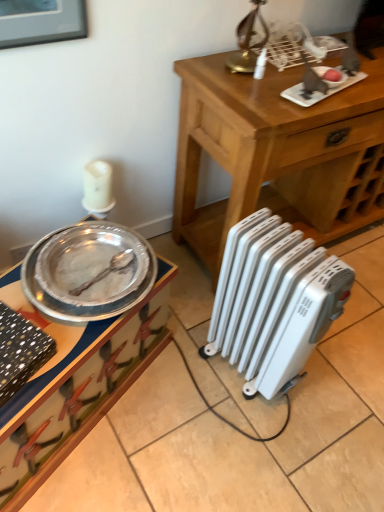
This screenshot has height=512, width=384. Describe the element at coordinates (41, 21) in the screenshot. I see `brushed metal picture frame at upper left` at that location.

Measure the distance between point (225, 353) and camera.

The depth of point (225, 353) is 5.12 feet.

What is the approximate width of wooden table at center?

19.20 inches.

Identify the location of brushed metal picture frame at upper left. This screenshot has height=512, width=384. (41, 21).

I want to click on table on the right of white plastic radiator at lower right, so click(x=277, y=153).

Between white plastic radiator at lower right and wooden table at center, which one has larger width?

wooden table at center.

Is white plastic radiator at lower right shorter than wooden table at center?

Yes, white plastic radiator at lower right is shorter than wooden table at center.

Which point is more distant from viewer, (287, 373) or (327, 136)?

The point (327, 136) is more distant.

How much distance is there between brushed metal picture frame at upper left and metallic silver tray at left?

34.94 inches.

Is brushed metal picture frame at upper left positioned with its back to metallic silver tray at left?

No, brushed metal picture frame at upper left's orientation is not away from metallic silver tray at left.

Is brushed metal picture frame at upper left wider or thinner than metallic silver tray at left?

Considering their sizes, brushed metal picture frame at upper left looks slimmer than metallic silver tray at left.

Is brushed metal picture frame at upper left to the left or to the right of metallic silver tray at left in the image?

In the image, brushed metal picture frame at upper left appears on the left side of metallic silver tray at left.

Is white plastic radiator at lower right wider or thinner than metallic silver tray at left?

Considering their sizes, white plastic radiator at lower right looks slimmer than metallic silver tray at left.

Relative to metallic silver tray at left, is white plastic radiator at lower right in front or behind?

Clearly, white plastic radiator at lower right is behind metallic silver tray at left.

Which is more to the left, white plastic radiator at lower right or metallic silver tray at left?

Positioned to the left is metallic silver tray at left.

From the image's perspective, does white plastic radiator at lower right appear lower than metallic silver tray at left?

No, from the image's perspective, white plastic radiator at lower right is not below metallic silver tray at left.

From a real-world perspective, is metallic silver tray at left below wooden table at center?

Yes, from a real-world perspective, metallic silver tray at left is below wooden table at center.

Considering the relative positions of metallic silver tray at left and wooden table at center in the image provided, is metallic silver tray at left to the right of wooden table at center from the viewer's perspective?

Incorrect, metallic silver tray at left is not on the right side of wooden table at center.

In terms of height, does metallic silver tray at left look taller or shorter compared to wooden table at center?

Considering their sizes, metallic silver tray at left has less height than wooden table at center.

Looking at their sizes, would you say brushed metal picture frame at upper left is wider or thinner than wooden table at center?

brushed metal picture frame at upper left is thinner than wooden table at center.

Is brushed metal picture frame at upper left positioned beyond the bounds of wooden table at center?

Indeed, brushed metal picture frame at upper left is completely outside wooden table at center.

From the image's perspective, does brushed metal picture frame at upper left appear lower than wooden table at center?

No.

Looking at this image, is brushed metal picture frame at upper left positioned behind wooden table at center?

No, brushed metal picture frame at upper left is closer to the camera.

Does metallic silver tray at left come in front of white plastic radiator at lower right?

Yes, metallic silver tray at left is in front of white plastic radiator at lower right.

From the image's perspective, is metallic silver tray at left above white plastic radiator at lower right?

No, from the image's perspective, metallic silver tray at left is not over white plastic radiator at lower right.

Is metallic silver tray at left surrounding white plastic radiator at lower right?

No, white plastic radiator at lower right is not surrounded by metallic silver tray at left.

Identify the location of picture frame that appears above the metallic silver tray at left (from the image's perspective). This screenshot has width=384, height=512. (41, 21).

Between metallic silver tray at left and brushed metal picture frame at upper left, which one appears on the left side from the viewer's perspective?

From the viewer's perspective, brushed metal picture frame at upper left appears more on the left side.

Which of these two, metallic silver tray at left or brushed metal picture frame at upper left, stands shorter?

With less height is brushed metal picture frame at upper left.

In the scene shown: What's the angular difference between metallic silver tray at left and brushed metal picture frame at upper left's facing directions?

23.7 degrees separate the facing orientations of metallic silver tray at left and brushed metal picture frame at upper left.

This screenshot has height=512, width=384. Identify the location of table behind the white plastic radiator at lower right. (277, 153).

I want to click on desk below the brushed metal picture frame at upper left (from a real-world perspective), so click(x=73, y=383).

Which object lies further to the anchor point wooden table at center, white plastic radiator at lower right or brushed metal picture frame at upper left?

brushed metal picture frame at upper left is positioned further to the anchor wooden table at center.

Based on their spatial positions, is white plastic radiator at lower right or metallic silver tray at left further from wooden table at center?

metallic silver tray at left lies further to wooden table at center than the other object.

Consider the image. Which object lies further to the anchor point metallic silver tray at left, brushed metal picture frame at upper left or wooden table at center?

brushed metal picture frame at upper left is positioned further to the anchor metallic silver tray at left.

Consider the image. Estimate the real-world distances between objects in this image. Which object is further from white plastic radiator at lower right, brushed metal picture frame at upper left or metallic silver tray at left?

brushed metal picture frame at upper left is positioned further to the anchor white plastic radiator at lower right.

Which object lies further to the anchor point metallic silver tray at left, wooden table at center or white plastic radiator at lower right?

Based on the image, wooden table at center appears to be further to metallic silver tray at left.

Looking at this image, looking at the image, which one is located closer to metallic silver tray at left, wooden table at center or brushed metal picture frame at upper left?

wooden table at center is positioned closer to the anchor metallic silver tray at left.

When comparing their distances from white plastic radiator at lower right, does metallic silver tray at left or brushed metal picture frame at upper left seem closer?

metallic silver tray at left lies closer to white plastic radiator at lower right than the other object.

Estimate the real-world distances between objects in this image. Which object is closer to brushed metal picture frame at upper left, white plastic radiator at lower right or metallic silver tray at left?

metallic silver tray at left lies closer to brushed metal picture frame at upper left than the other object.

At what (x,y) coordinates should I click in order to perform the action: click on radiator located between metallic silver tray at left and wooden table at center in the left-right direction. Please return your answer as a coordinate pair (x, y). The width and height of the screenshot is (384, 512). Looking at the image, I should click on (273, 301).

This screenshot has width=384, height=512. What are the coordinates of `radiator located between brushed metal picture frame at upper left and wooden table at center in the left-right direction` in the screenshot? It's located at (273, 301).

Where is `desk between brushed metal picture frame at upper left and wooden table at center`? Image resolution: width=384 pixels, height=512 pixels. desk between brushed metal picture frame at upper left and wooden table at center is located at coordinates (73, 383).

Locate an element on the screen. The width and height of the screenshot is (384, 512). radiator between brushed metal picture frame at upper left and metallic silver tray at left in the vertical direction is located at coordinates (273, 301).